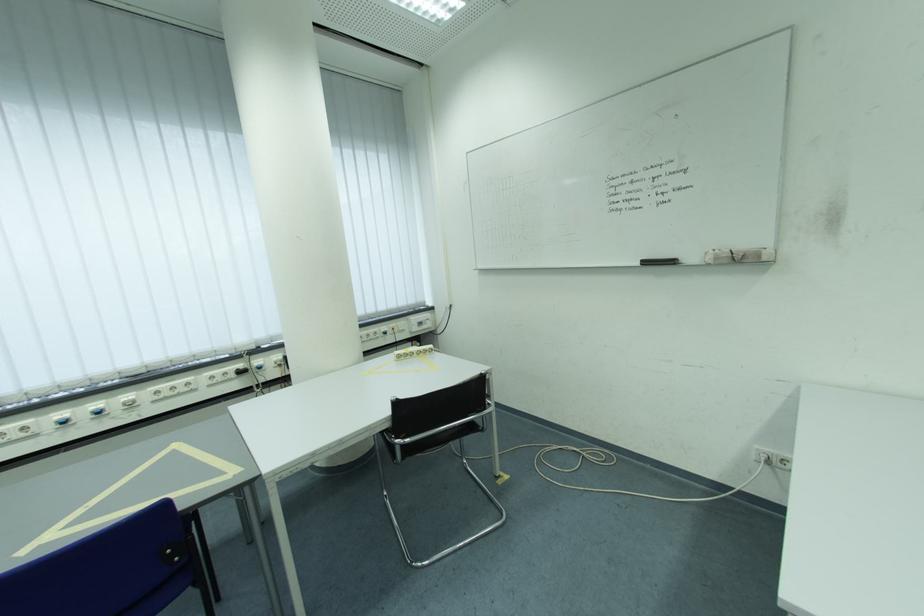
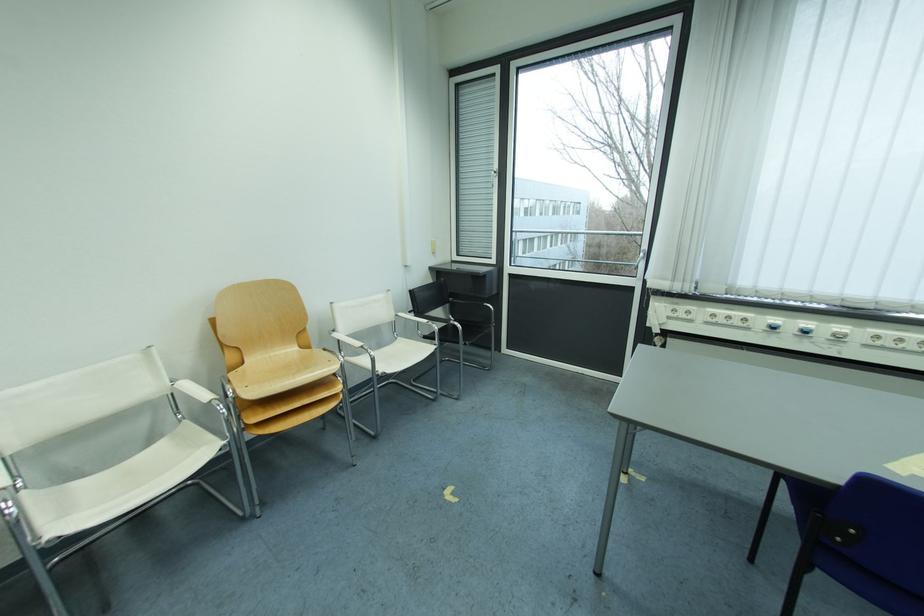
First-person continuous shooting, in which direction is the camera rotating?

The rotation direction of the camera is left-down.